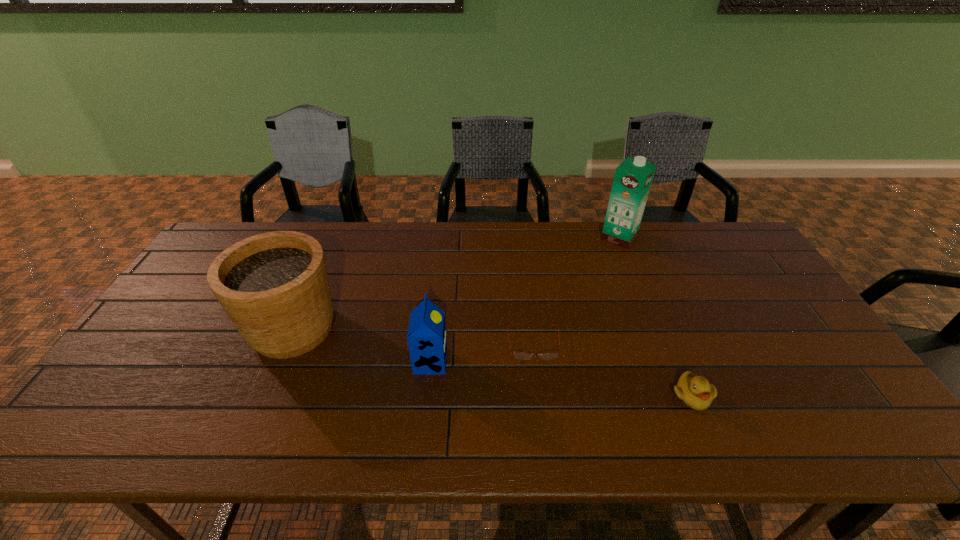
Identify the location of free space located on the front of the farthest object. (634, 274).

Identify the location of blank area located on the left of the leftmost object. (202, 329).

Locate an element on the screen. The image size is (960, 540). free spot located with the cap open on the left carton is located at coordinates (497, 362).

Identify the location of vacant region located at the beak of the nearest object. The height and width of the screenshot is (540, 960). (712, 446).

The image size is (960, 540). In order to click on vacant space situated on the lenses of the spectacles in this screenshot , I will do `click(542, 418)`.

The image size is (960, 540). Identify the location of object present at the far edge. (633, 177).

This screenshot has width=960, height=540. Find the location of `object that is at the near edge`. object that is at the near edge is located at coordinates (696, 392).

Locate an element on the screen. The image size is (960, 540). vacant space at the far edge is located at coordinates (326, 231).

What are the coordinates of `vacant region at the near edge of the desktop` in the screenshot? It's located at (349, 443).

Where is `blank space at the left edge of the desktop`? This screenshot has width=960, height=540. blank space at the left edge of the desktop is located at coordinates (188, 292).